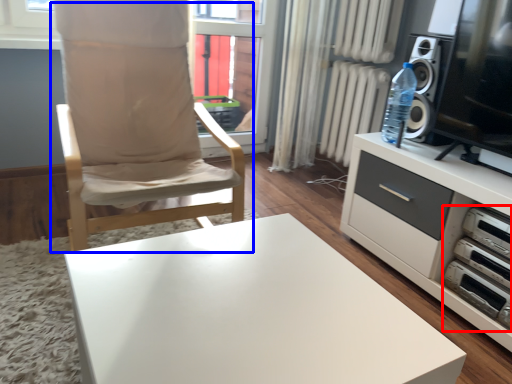
Question: Which point is further to the camera, stereo (highlighted by a red box) or chair (highlighted by a blue box)?

Choices:
 (A) stereo
 (B) chair

Answer: (A)